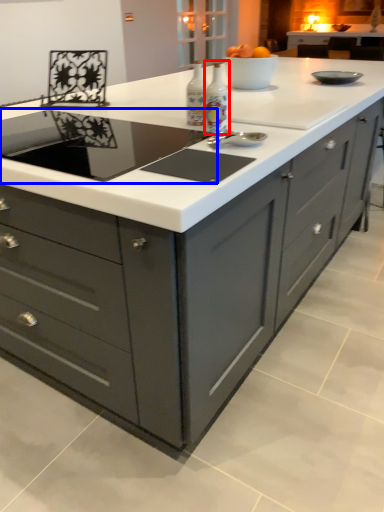
Question: Among these objects, which one is nearest to the camera, appliance (highlighted by a red box) or home appliance (highlighted by a blue box)?

Choices:
 (A) appliance
 (B) home appliance

Answer: (B)